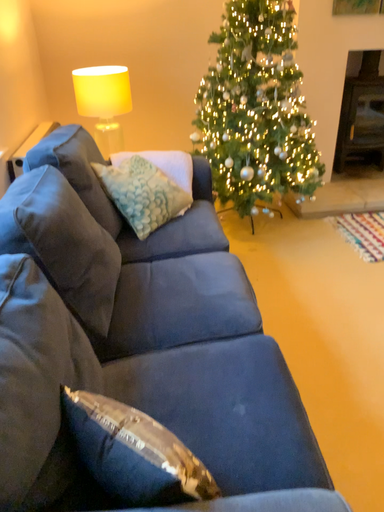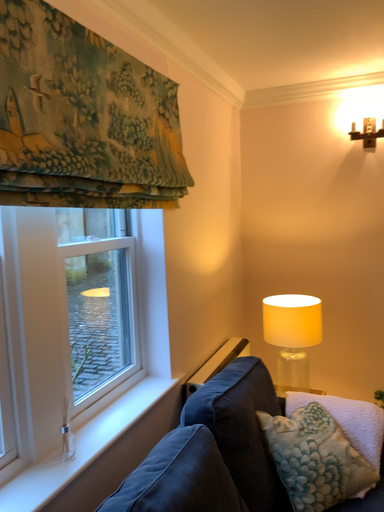
Question: Which way did the camera rotate in the video?

Choices:
 (A) rotated upward
 (B) rotated downward

Answer: (A)